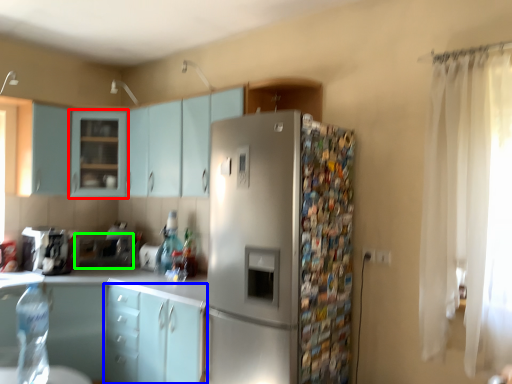
Question: Considering the real-world distances, which object is farthest from cabinetry (highlighted by a red box)? cabinetry (highlighted by a blue box) or appliance (highlighted by a green box)?

Choices:
 (A) cabinetry
 (B) appliance

Answer: (A)